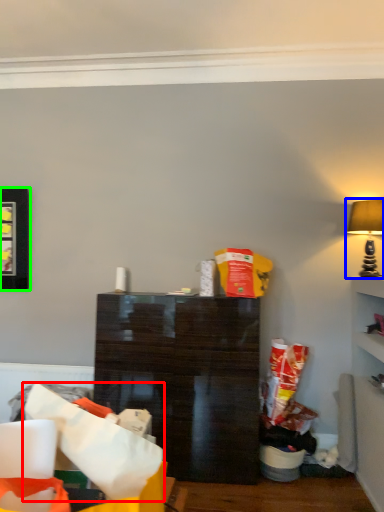
Question: Which object is the closest to the paper bag (highlighted by a red box)? Choose among these: lamp (highlighted by a blue box) or picture frame (highlighted by a green box).

Choices:
 (A) lamp
 (B) picture frame

Answer: (A)